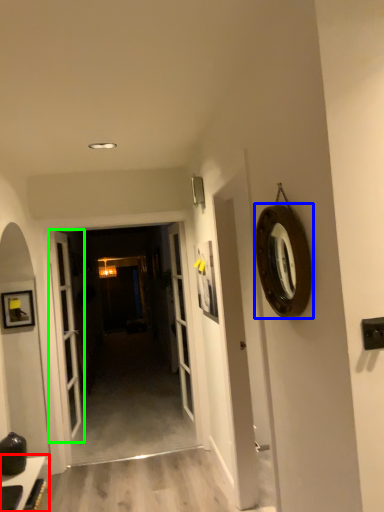
Question: Based on their relative distances, which object is nearer to table (highlighted by a red box)? Choose from oval (highlighted by a blue box) and door (highlighted by a green box).

Choices:
 (A) oval
 (B) door

Answer: (B)